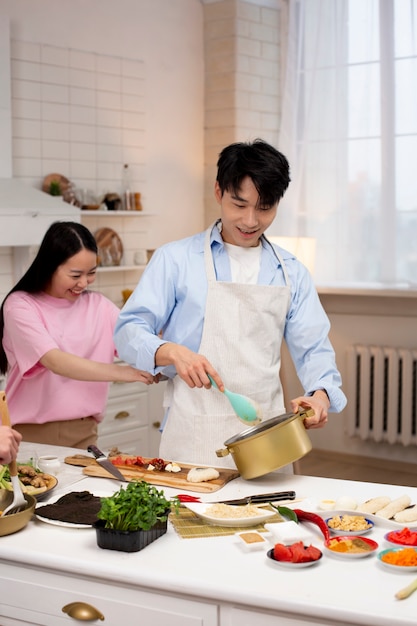
Image resolution: width=417 pixels, height=626 pixels. What are the coordinates of `pot` in the screenshot? It's located at (263, 427).